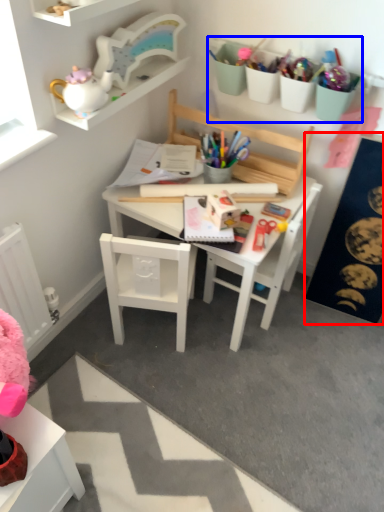
Question: Which of the following is the closest to the observer, bulletin board (highlighted by a red box) or stationery (highlighted by a blue box)?

Choices:
 (A) bulletin board
 (B) stationery

Answer: (A)